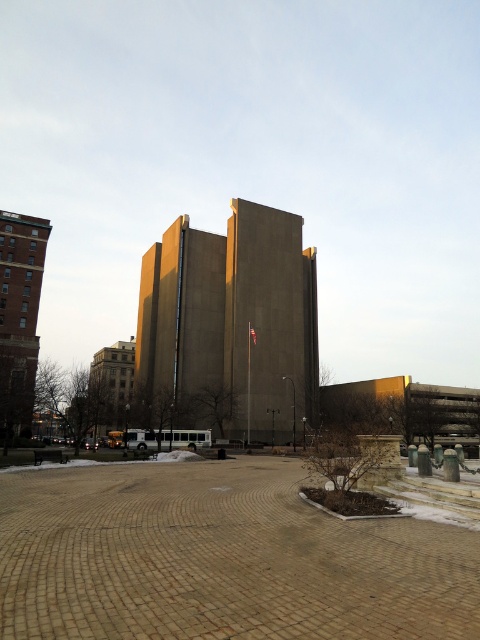
Looking at this image, does concrete building at center have a lesser height compared to brick tower at left?

No, concrete building at center is not shorter than brick tower at left.

Locate an element on the screen. The image size is (480, 640). concrete building at center is located at coordinates (231, 324).

Which is behind, point (205, 404) or point (44, 218)?

The point (44, 218) is more distant.

At what (x,y) coordinates should I click in order to perform the action: click on concrete building at center. Please return your answer as a coordinate pair (x, y). Looking at the image, I should click on (231, 324).

Who is more forward, [313,621] or [269,436]?

Positioned in front is point [313,621].

Where is `brown brick plaza at center`? brown brick plaza at center is located at coordinates (219, 557).

Is brown brick plaza at center taller than brick tower at left?

Incorrect, brown brick plaza at center's height is not larger of brick tower at left's.

Can you confirm if brown brick plaza at center is wider than brick tower at left?

In fact, brown brick plaza at center might be narrower than brick tower at left.

This screenshot has height=640, width=480. Describe the element at coordinates (219, 557) in the screenshot. I see `brown brick plaza at center` at that location.

The height and width of the screenshot is (640, 480). I want to click on brown brick plaza at center, so click(x=219, y=557).